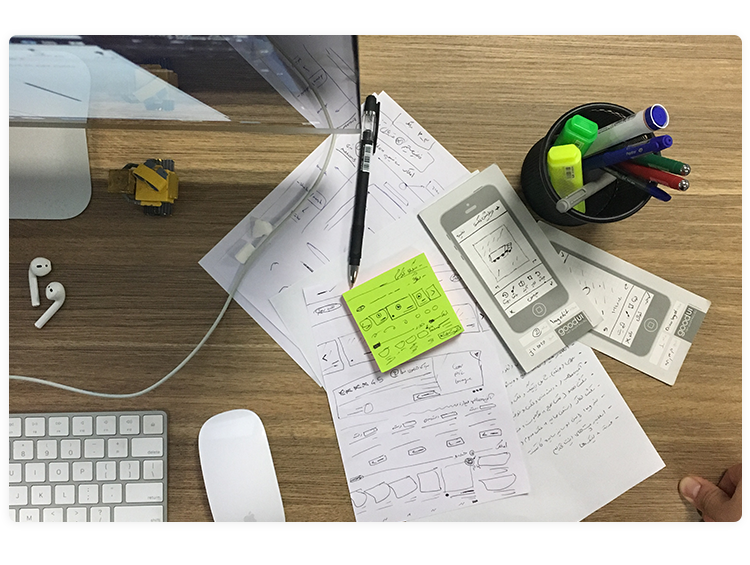
The height and width of the screenshot is (565, 750). In order to click on table in this screenshot , I will do `click(549, 79)`.